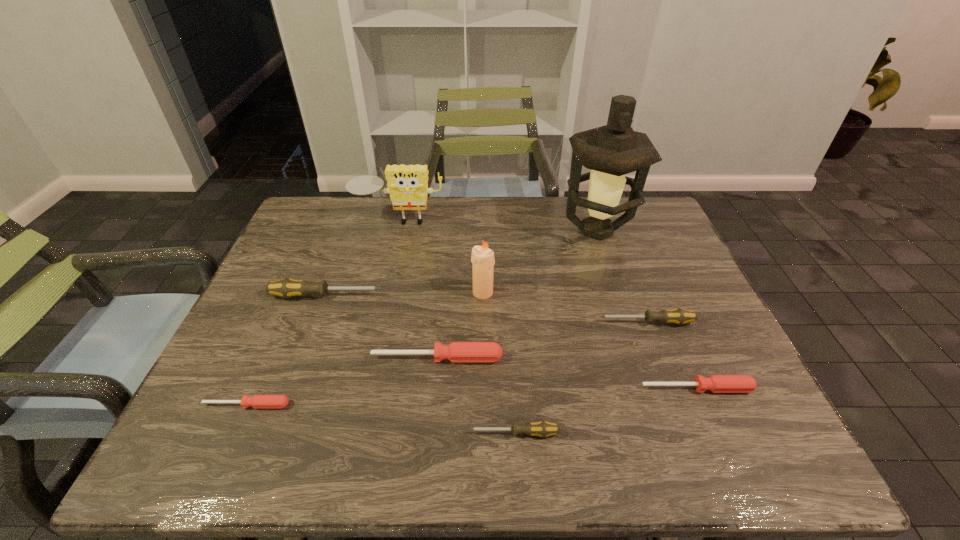
Image resolution: width=960 pixels, height=540 pixels. I want to click on oil lamp, so click(x=611, y=151).

Image resolution: width=960 pixels, height=540 pixels. Find the location of `sponge`. sponge is located at coordinates (407, 185).

Where is `candle`? The width and height of the screenshot is (960, 540). candle is located at coordinates (482, 258).

The image size is (960, 540). I want to click on the sixth shortest object, so point(287,288).

In order to click on the farthest screwdriver in this screenshot , I will do `click(287, 288)`.

Where is `the fifth nearest object`? the fifth nearest object is located at coordinates (678, 316).

Where is `the second nearest gray screwdriver`? the second nearest gray screwdriver is located at coordinates (678, 316).

This screenshot has height=540, width=960. Find the location of `the farthest red screwdriver`. the farthest red screwdriver is located at coordinates (456, 351).

Where is `the biggest red screwdriver`? The height and width of the screenshot is (540, 960). the biggest red screwdriver is located at coordinates (456, 351).

Locate an element on the screen. the seventh farthest object is located at coordinates (715, 383).